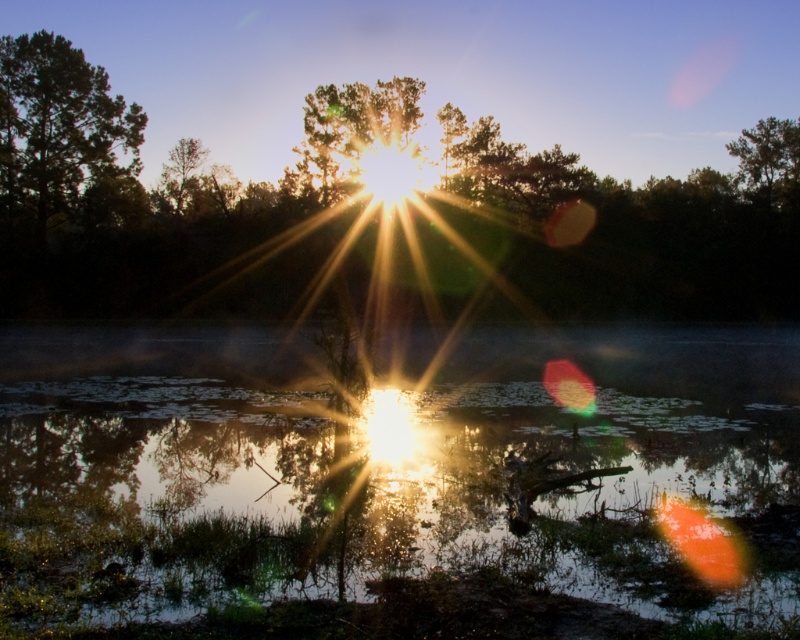
Between silvery metallic tree at center and green matte tree at upper left, which one has less height?

Standing shorter between the two is green matte tree at upper left.

Is point (62, 225) behind point (40, 209)?

That is True.

At what (x,y) coordinates should I click in order to perform the action: click on silvery metallic tree at center. Please return your answer as a coordinate pair (x, y). The height and width of the screenshot is (640, 800). Looking at the image, I should click on (158, 193).

Is green matte tree at upper left to the right of green matte tree at upper right from the viewer's perspective?

In fact, green matte tree at upper left is to the left of green matte tree at upper right.

Find the location of a particular element. The height and width of the screenshot is (640, 800). green matte tree at upper left is located at coordinates (57, 125).

Who is more forward, (10, 618) or (24, 132)?

Point (10, 618) is in front.

Locate an element on the screen. This screenshot has height=640, width=800. transparent water at center is located at coordinates (394, 483).

The width and height of the screenshot is (800, 640). What are the coordinates of `transparent water at center` in the screenshot? It's located at (394, 483).